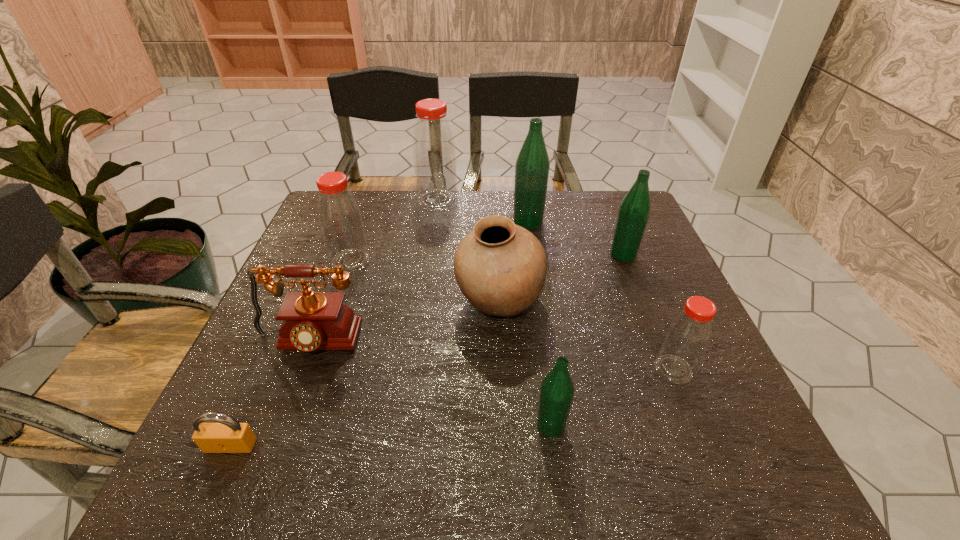
The height and width of the screenshot is (540, 960). What are the coordinates of `vacant region that satisfies the following two spatial constraints: 1. on the front side of the leftmost bottle; 2. on the left side of the fifth farthest bottle` in the screenshot? It's located at (313, 369).